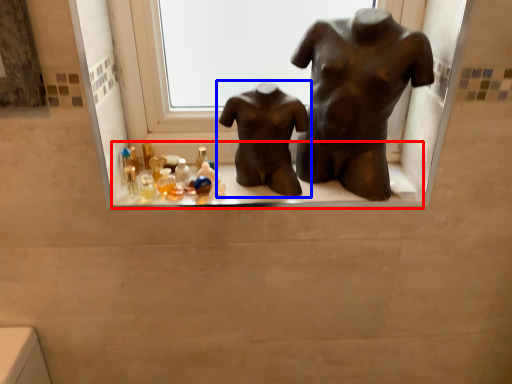
Question: Among these objects, which one is nearest to the camera, window sill (highlighted by a red box) or statue (sculpture) (highlighted by a blue box)?

Choices:
 (A) window sill
 (B) statue (sculpture)

Answer: (B)